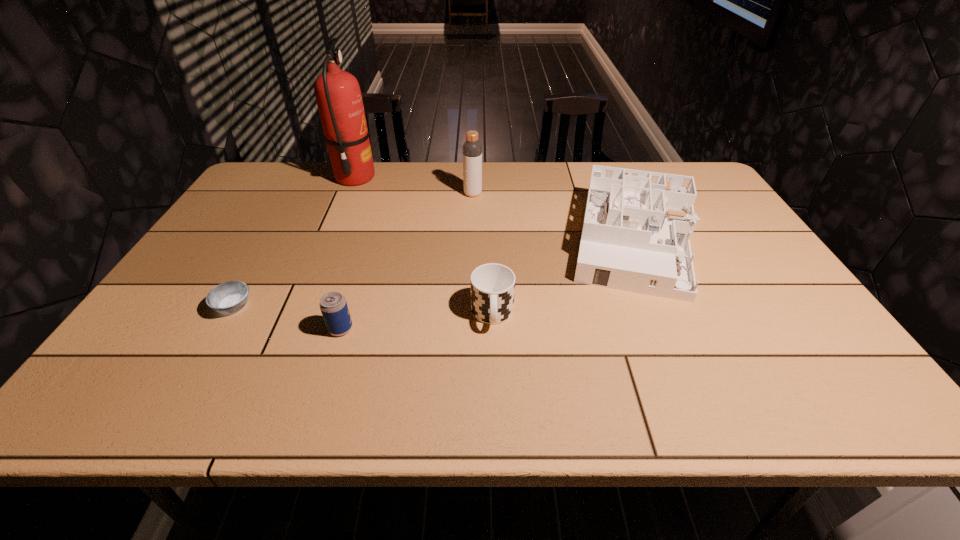
Where is `free spot located 0.240m on the right of the fifth shortest object`? The width and height of the screenshot is (960, 540). free spot located 0.240m on the right of the fifth shortest object is located at coordinates pos(555,194).

Identify the location of vacant area situated 0.100m on the front of the fourth shortest object. The image size is (960, 540). (670, 334).

Locate an element on the screen. The image size is (960, 540). free space located on the side of the cup with the handle is located at coordinates (495, 411).

Identify the location of free spot located on the right of the beer can. The height and width of the screenshot is (540, 960). (495, 329).

Locate an element on the screen. The height and width of the screenshot is (540, 960). vacant area located 0.080m on the left of the shortest object is located at coordinates (181, 307).

Find the location of `fire extinguisher at the far edge`. fire extinguisher at the far edge is located at coordinates (338, 95).

Identify the location of bottle situated at the far edge. The width and height of the screenshot is (960, 540). (472, 149).

Find the location of a particular element. object situated at the left edge is located at coordinates (229, 297).

Locate an element on the screen. Image resolution: width=960 pixels, height=540 pixels. object at the right edge is located at coordinates (637, 227).

This screenshot has width=960, height=540. In order to click on vacant space at the far edge in this screenshot , I will do `click(430, 192)`.